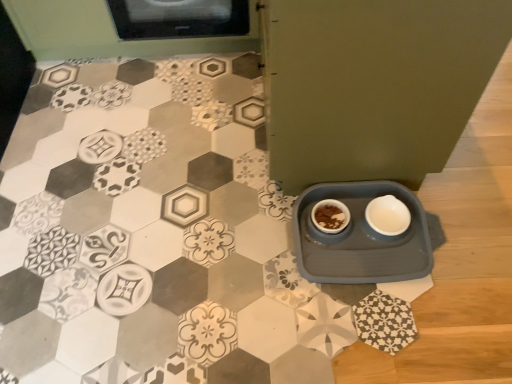
Locate an element on the screen. unoccupied space behind white matte bowl at lower right is located at coordinates (378, 197).